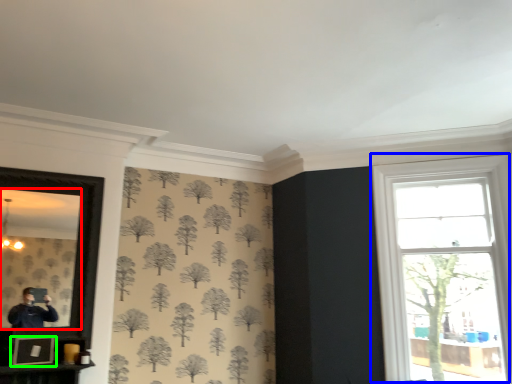
Question: Which is nearer to the mirror (highlighted by a red box)? window (highlighted by a blue box) or picture frame (highlighted by a green box).

Choices:
 (A) window
 (B) picture frame

Answer: (B)